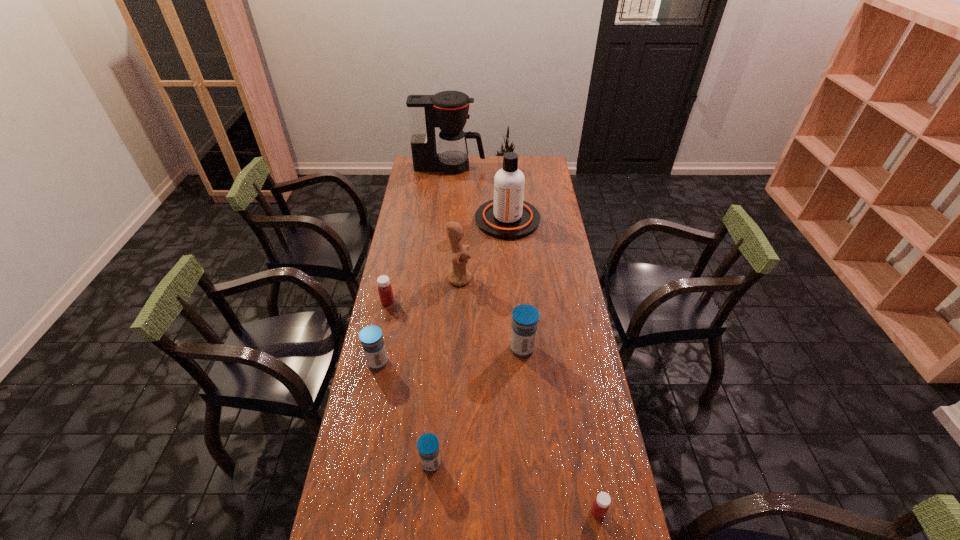
Where is `coffee maker`? This screenshot has width=960, height=540. coffee maker is located at coordinates (448, 110).

Locate an element on the screen. Image resolution: width=960 pixels, height=540 pixels. cleansing agent is located at coordinates (508, 217).

This screenshot has width=960, height=540. I want to click on the seventh nearest object, so click(508, 217).

Where is `the third tallest object`? The width and height of the screenshot is (960, 540). the third tallest object is located at coordinates (459, 276).

Identify the location of figurine. Image resolution: width=960 pixels, height=540 pixels. (459, 276).

At what (x,y) coordinates should I click in order to perform the action: click on the rightmost blue medicine. Please return your answer as a coordinate pair (x, y). The image size is (960, 540). Looking at the image, I should click on (525, 317).

Where is `the tallest medicine`? the tallest medicine is located at coordinates (525, 317).

Image resolution: width=960 pixels, height=540 pixels. I want to click on the fifth tallest object, so click(x=371, y=337).

Identify the location of the second tallest medicine. (371, 337).

Where is `the left red medicine`? This screenshot has height=540, width=960. the left red medicine is located at coordinates (385, 291).